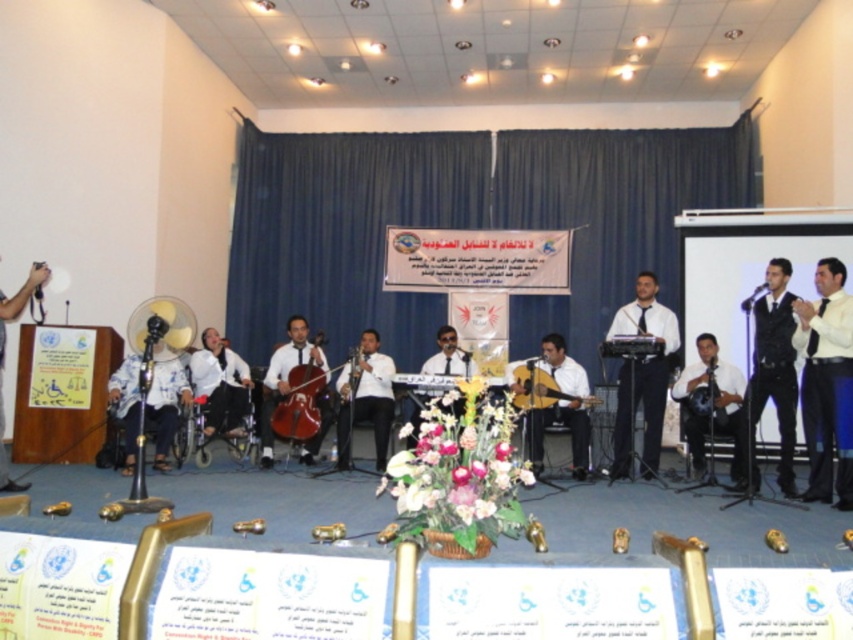
Question: Can you confirm if white glossy saxophone at center is wider than matte black camera at left?

Choices:
 (A) no
 (B) yes

Answer: (A)

Question: Which of the following is the farthest from the observer?

Choices:
 (A) (831, 275)
 (B) (445, 330)
 (C) (764, 288)
 (D) (234, 432)

Answer: (B)

Question: Is white glossy keyboard at center bigger than matte black guitar at center?

Choices:
 (A) no
 (B) yes

Answer: (A)

Question: Can you confirm if white glossy saxophone at center is positioned to the left of white fabric shirt at center?

Choices:
 (A) yes
 (B) no

Answer: (B)

Question: Which point is closer to the camera?

Choices:
 (A) pyautogui.click(x=378, y=333)
 (B) pyautogui.click(x=846, y=333)

Answer: (B)

Question: Which of the following is the farthest from the observer?

Choices:
 (A) (793, 493)
 (B) (822, 291)

Answer: (A)